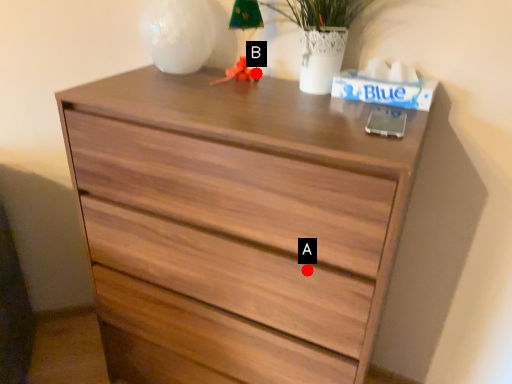
Question: Two points are circled on the image, labeled by A and B beside each circle. Which point is further to the camera?

Choices:
 (A) A is further
 (B) B is further

Answer: (B)